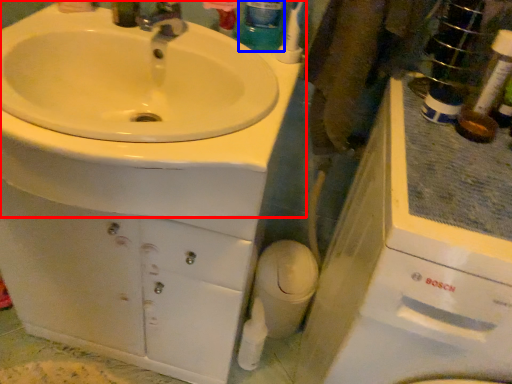
Question: Which object is further to the camera taking this photo, sink (highlighted by a red box) or mouthwash (highlighted by a blue box)?

Choices:
 (A) sink
 (B) mouthwash

Answer: (B)